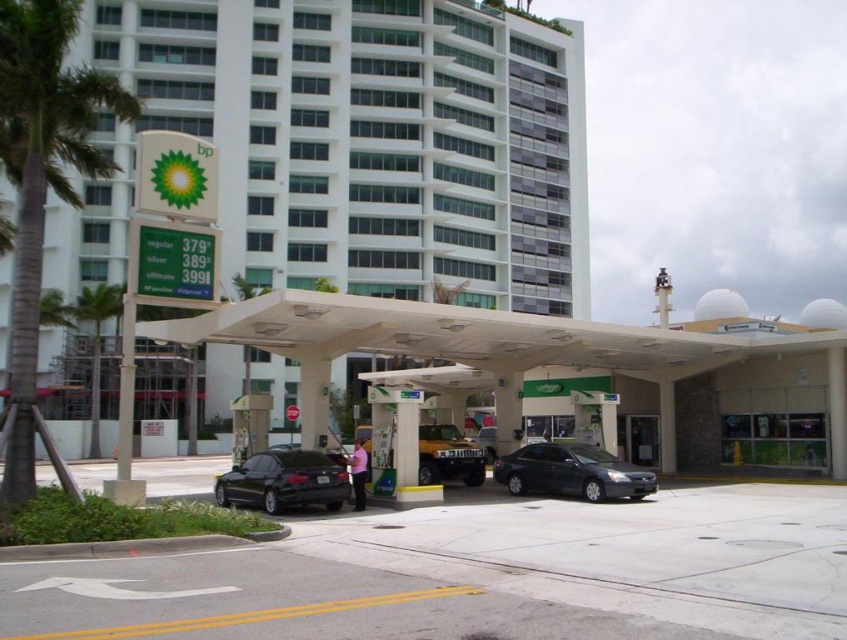
Question: Does shiny black sedan at lower left appear over metallic gold suv at center?

Choices:
 (A) no
 (B) yes

Answer: (B)

Question: Considering the real-world distances, which object is farthest from the shiny dark gray sedan at center?

Choices:
 (A) metallic gold suv at center
 (B) green leafy palm tree at left

Answer: (B)

Question: Is shiny dark gray sedan at center smaller than metallic gold suv at center?

Choices:
 (A) yes
 (B) no

Answer: (A)

Question: Is shiny dark gray sedan at center thinner than green leafy palm tree at center-left?

Choices:
 (A) no
 (B) yes

Answer: (B)

Question: Considering the real-world distances, which object is farthest from the shiny dark gray sedan at center?

Choices:
 (A) metallic gold suv at center
 (B) shiny black sedan at lower left
 (C) white smooth building at upper center

Answer: (C)

Question: Which point is farther to the camera?

Choices:
 (A) 436,435
 (B) 93,419
 (C) 59,13
 (D) 231,483

Answer: (B)